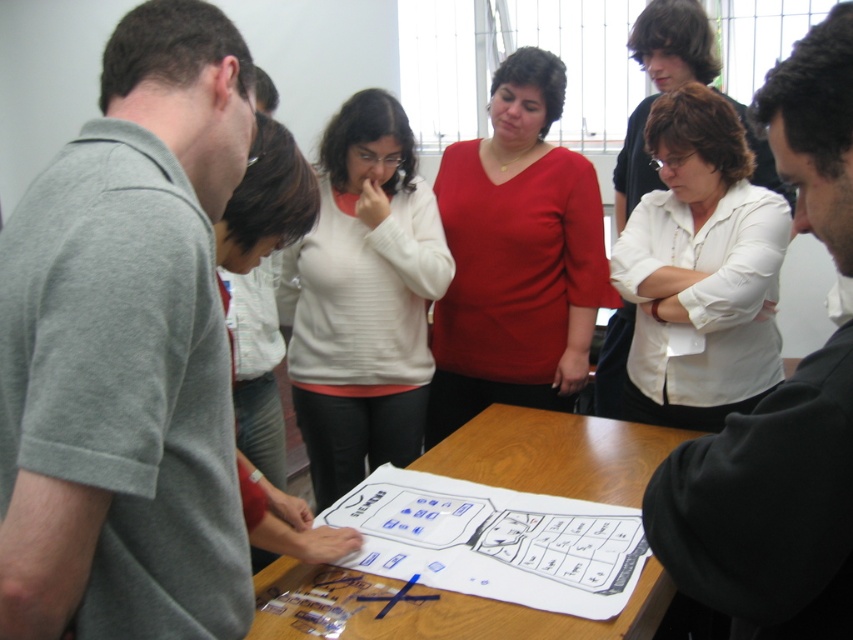
Question: Is gray cotton shirt at left thinner than wooden table at center?

Choices:
 (A) no
 (B) yes

Answer: (B)

Question: Is gray cotton shirt at left below wooden table at center?

Choices:
 (A) yes
 (B) no

Answer: (B)

Question: Considering the real-world distances, which object is farthest from the gray cotton shirt at left?

Choices:
 (A) white matte shirt at center
 (B) wooden table at center
 (C) white ribbed sweater at center

Answer: (A)

Question: Which object is the farthest from the gray cotton shirt at left?

Choices:
 (A) white ribbed sweater at center
 (B) black matte shirt at center
 (C) wooden table at center

Answer: (A)

Question: Can you confirm if black matte shirt at center is positioned to the right of white ribbed sweater at center?

Choices:
 (A) yes
 (B) no

Answer: (A)

Question: Which of the following is the farthest from the observer?

Choices:
 (A) (360, 132)
 (B) (451, 317)
 (C) (148, 563)
 (D) (848, 314)

Answer: (B)